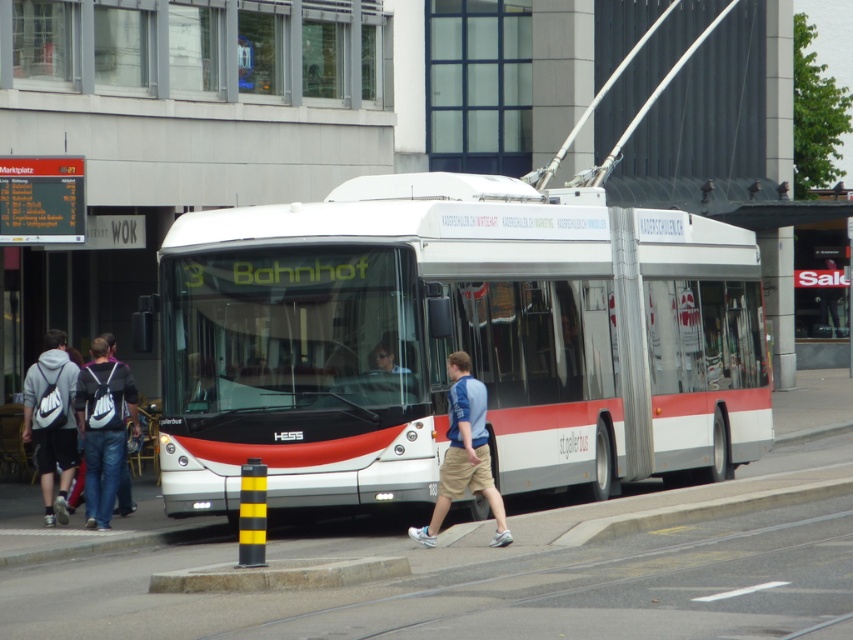
Who is more forward, (x=296, y=548) or (x=434, y=536)?

Point (x=434, y=536) is more forward.

Is white concrete pavement at center to the right of light blue jersey at center from the viewer's perspective?

Yes, white concrete pavement at center is to the right of light blue jersey at center.

Where is `white concrete pavement at center`? This screenshot has width=853, height=640. white concrete pavement at center is located at coordinates (509, 570).

Can you confirm if white metallic bus at center is positioned to the right of white concrete pavement at center?

In fact, white metallic bus at center is to the left of white concrete pavement at center.

Is white metallic bus at center bigger than white concrete pavement at center?

Indeed, white metallic bus at center has a larger size compared to white concrete pavement at center.

This screenshot has width=853, height=640. What do you see at coordinates (454, 340) in the screenshot?
I see `white metallic bus at center` at bounding box center [454, 340].

Locate an element on the screen. white metallic bus at center is located at coordinates (454, 340).

Can you confirm if white metallic bus at center is bigger than gray fabric backpack at left?

Yes, white metallic bus at center is bigger than gray fabric backpack at left.

Can you confirm if white metallic bus at center is taller than gray fabric backpack at left?

Correct, white metallic bus at center is much taller as gray fabric backpack at left.

Is point (170, 288) positioned after point (51, 472)?

No, (170, 288) is closer to viewer.

This screenshot has height=640, width=853. Find the location of `white metallic bus at center`. white metallic bus at center is located at coordinates (454, 340).